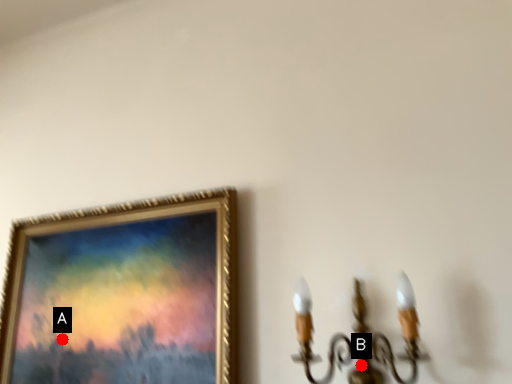
Question: Two points are circled on the image, labeled by A and B beside each circle. Which of the following is the closest to the observer?

Choices:
 (A) A is closer
 (B) B is closer

Answer: (B)